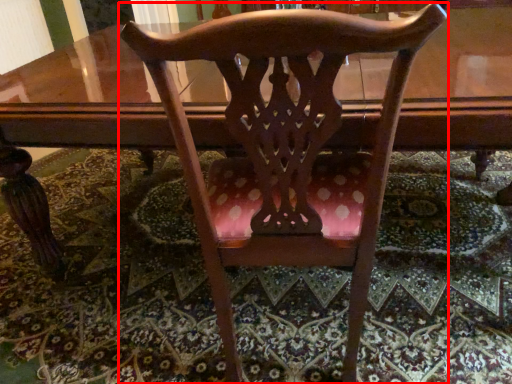
Question: From the image's perspective, what is the correct spatial relationship of chair (annotated by the red box) in relation to mat?

Choices:
 (A) below
 (B) above

Answer: (B)